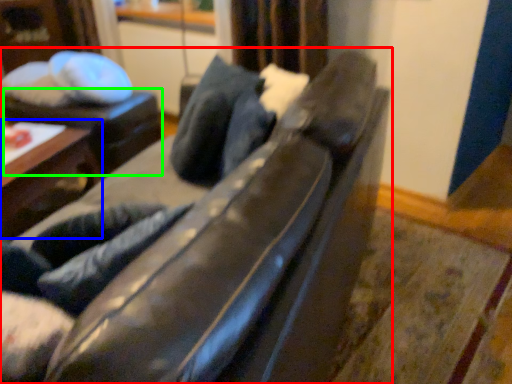
Question: Which object is positioned farthest from studio couch (highlighted by a red box)? Select from table (highlighted by a blue box) and table (highlighted by a green box).

Choices:
 (A) table
 (B) table

Answer: (B)